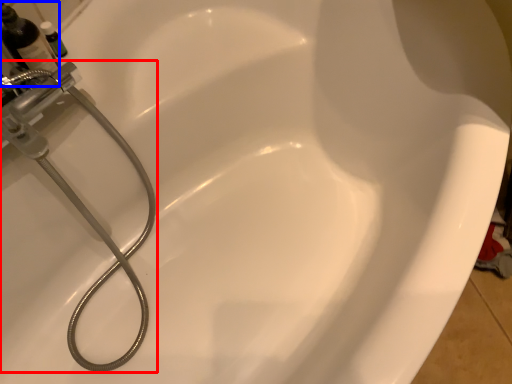
Question: Which point is closer to the camera, plumbing fixture (highlighted by a red box) or bottle (highlighted by a blue box)?

Choices:
 (A) plumbing fixture
 (B) bottle

Answer: (A)